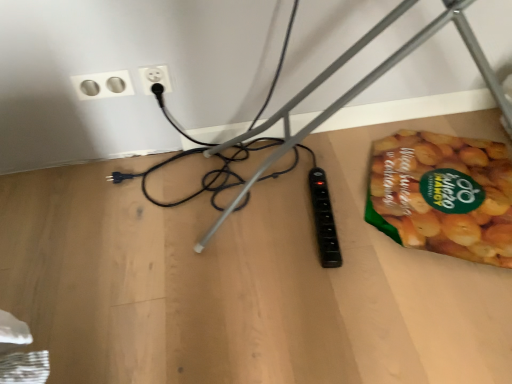
Question: Considering the relative sizes of white plastic socket at upper center, positioned as the first power plugs and sockets in right-to-left order, and silver metallic socket at upper left, marked as the first power plugs and sockets in a left-to-right arrangement, in the image provided, is white plastic socket at upper center, positioned as the first power plugs and sockets in right-to-left order, smaller than silver metallic socket at upper left, marked as the first power plugs and sockets in a left-to-right arrangement,?

Choices:
 (A) no
 (B) yes

Answer: (A)

Question: Is white plastic socket at upper center, positioned as the first power plugs and sockets in right-to-left order, to the right of silver metallic socket at upper left, marked as the first power plugs and sockets in a left-to-right arrangement, from the viewer's perspective?

Choices:
 (A) no
 (B) yes

Answer: (B)

Question: Is white plastic socket at upper center, the 2th power plugs and sockets positioned from the left, facing towards silver metallic socket at upper left, marked as the first power plugs and sockets in a left-to-right arrangement?

Choices:
 (A) yes
 (B) no

Answer: (B)

Question: From a real-world perspective, is white plastic socket at upper center, positioned as the first power plugs and sockets in right-to-left order, below silver metallic socket at upper left, marked as the first power plugs and sockets in a left-to-right arrangement?

Choices:
 (A) yes
 (B) no

Answer: (B)

Question: From the image's perspective, does white plastic socket at upper center, positioned as the first power plugs and sockets in right-to-left order, appear lower than silver metallic socket at upper left, marked as the first power plugs and sockets in a left-to-right arrangement?

Choices:
 (A) no
 (B) yes

Answer: (A)

Question: Is white plastic socket at upper center, the 2th power plugs and sockets positioned from the left, wider than silver metallic socket at upper left, positioned as the 2th power plugs and sockets in right-to-left order?

Choices:
 (A) no
 (B) yes

Answer: (B)

Question: Considering the relative sizes of wooden table at lower right and green matte snack packet at lower right in the image provided, is wooden table at lower right thinner than green matte snack packet at lower right?

Choices:
 (A) no
 (B) yes

Answer: (A)

Question: Is wooden table at lower right not inside green matte snack packet at lower right?

Choices:
 (A) yes
 (B) no

Answer: (A)

Question: Is wooden table at lower right positioned in front of green matte snack packet at lower right?

Choices:
 (A) no
 (B) yes

Answer: (B)

Question: Is wooden table at lower right facing towards green matte snack packet at lower right?

Choices:
 (A) no
 (B) yes

Answer: (A)

Question: Does wooden table at lower right contain green matte snack packet at lower right?

Choices:
 (A) yes
 (B) no

Answer: (B)

Question: From the image's perspective, is wooden table at lower right over green matte snack packet at lower right?

Choices:
 (A) yes
 (B) no

Answer: (B)

Question: Is white plastic socket at upper center, positioned as the first power plugs and sockets in right-to-left order, facing towards wooden table at lower right?

Choices:
 (A) yes
 (B) no

Answer: (B)